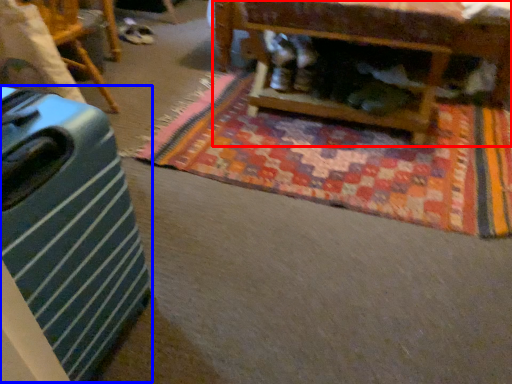
Question: Among these objects, which one is farthest to the camera, furniture (highlighted by a red box) or luggage (highlighted by a blue box)?

Choices:
 (A) furniture
 (B) luggage

Answer: (A)